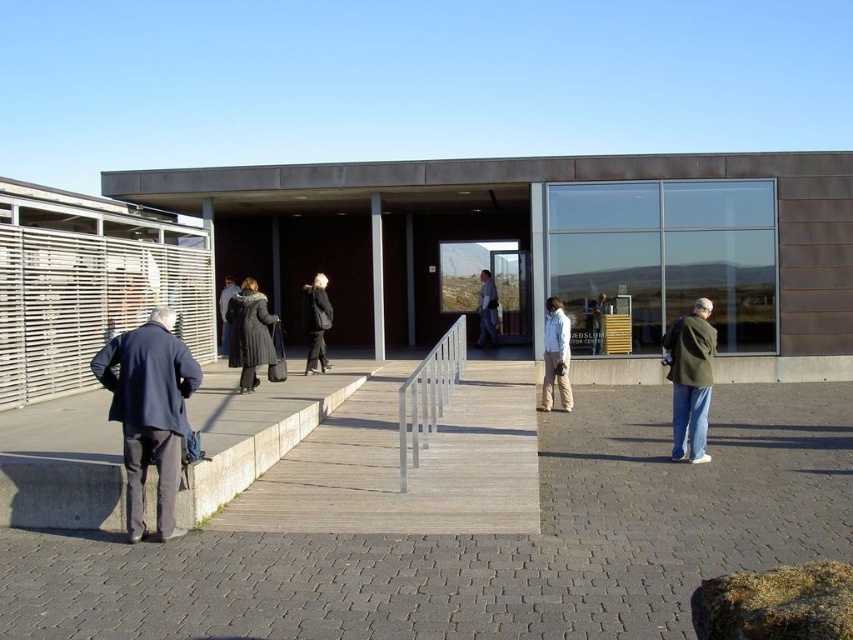
Does silver metallic rail at center have a lesser width compared to white matte jacket at center?

No, silver metallic rail at center is not thinner than white matte jacket at center.

Between silver metallic rail at center and white matte jacket at center, which one is positioned higher?

white matte jacket at center is above.

The image size is (853, 640). Find the location of `silver metallic rail at center`. silver metallic rail at center is located at coordinates (428, 396).

Does dark blue coat at left appear over dark gray fur coat at center?

No.

Does point (132, 364) lie in front of point (247, 330)?

Yes, it is.

Identify the location of dark blue coat at left. (149, 412).

Does green wool coat at right have a greater width compared to light brown leather jacket at center?

Indeed, green wool coat at right has a greater width compared to light brown leather jacket at center.

Can you confirm if green wool coat at right is shorter than light brown leather jacket at center?

Correct, green wool coat at right is not as tall as light brown leather jacket at center.

Does point (688, 413) come behind point (480, 317)?

No.

Image resolution: width=853 pixels, height=640 pixels. In order to click on green wool coat at right in this screenshot , I will do `click(689, 380)`.